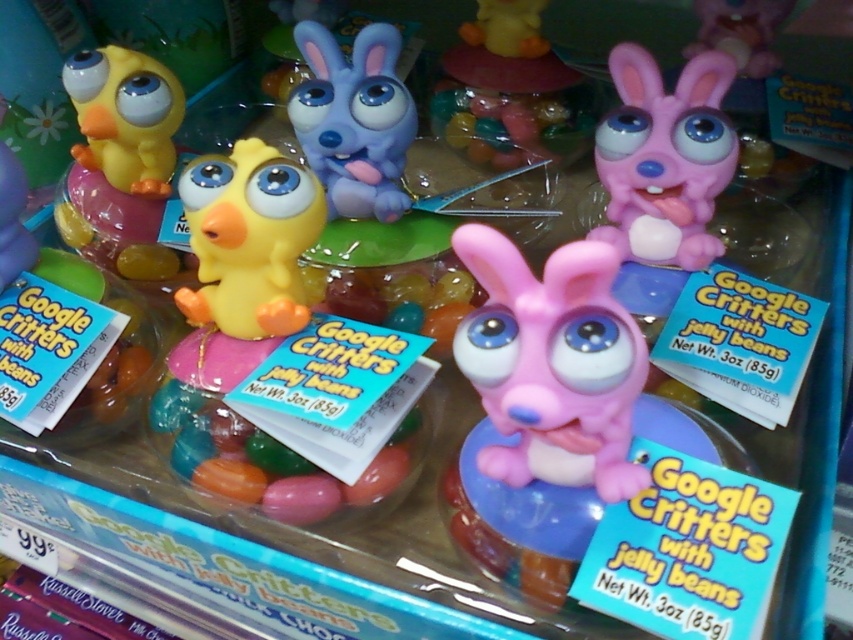
Is matte pink plastic bunny at center positioned in front of pink rubber bunny at upper center?

Yes, matte pink plastic bunny at center is in front of pink rubber bunny at upper center.

Does point (529, 356) come in front of point (572, 108)?

Yes, point (529, 356) is closer to viewer.

Identify the location of matte pink plastic bunny at center. The height and width of the screenshot is (640, 853). (552, 364).

Is pink rubber bunny at upper right to the right of pink rubber bunny at upper center from the viewer's perspective?

Yes, pink rubber bunny at upper right is to the right of pink rubber bunny at upper center.

Does pink rubber bunny at upper right have a lesser height compared to pink rubber bunny at upper center?

Correct, pink rubber bunny at upper right is not as tall as pink rubber bunny at upper center.

Is point (717, 173) more distant than point (495, 147)?

No, (717, 173) is closer to viewer.

Where is `pink rubber bunny at upper right`? This screenshot has height=640, width=853. pink rubber bunny at upper right is located at coordinates (665, 157).

Based on the photo, between matte yellow rubber duck at left and matte yellow rubber duck at upper left, which one has less height?

matte yellow rubber duck at left

Can you confirm if matte yellow rubber duck at left is positioned above matte yellow rubber duck at upper left?

Actually, matte yellow rubber duck at left is below matte yellow rubber duck at upper left.

Describe the element at coordinates (242, 259) in the screenshot. This screenshot has height=640, width=853. I see `matte yellow rubber duck at left` at that location.

This screenshot has width=853, height=640. I want to click on matte yellow rubber duck at left, so click(x=242, y=259).